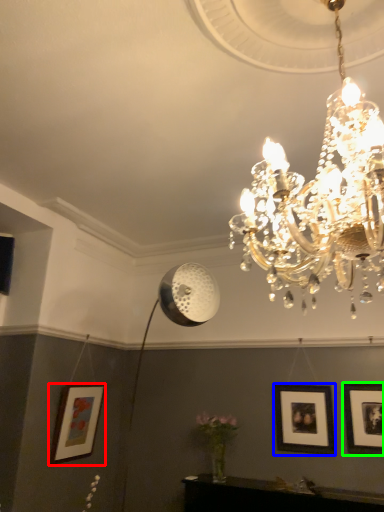
Question: Which object is positioned farthest from picture frame (highlighted by a red box)? Select from picture frame (highlighted by a blue box) and picture frame (highlighted by a green box).

Choices:
 (A) picture frame
 (B) picture frame

Answer: (B)